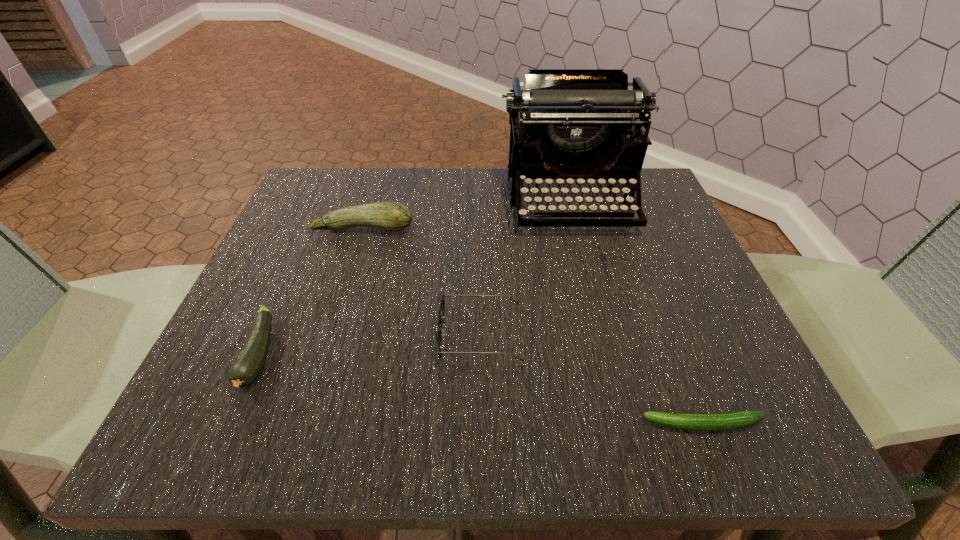
The width and height of the screenshot is (960, 540). Find the location of `typewriter`. typewriter is located at coordinates (580, 124).

Locate an element on the screen. The image size is (960, 540). the fourth shortest object is located at coordinates (391, 216).

Locate an element on the screen. the tallest zucchini is located at coordinates (391, 216).

Where is `spectacles`? spectacles is located at coordinates (442, 305).

The width and height of the screenshot is (960, 540). Identify the location of the second tallest zucchini. (246, 367).

The width and height of the screenshot is (960, 540). In order to click on the shortest object in this screenshot , I will do `click(729, 421)`.

The width and height of the screenshot is (960, 540). I want to click on the nearest object, so click(729, 421).

Find the location of a particular element. blank area located on the typing side of the tallest object is located at coordinates (588, 267).

Find the location of a particular element. blank space located at the stem end of the farthest zucchini is located at coordinates (309, 402).

This screenshot has width=960, height=540. I want to click on free location located through the lenses of the spectacles, so click(x=263, y=336).